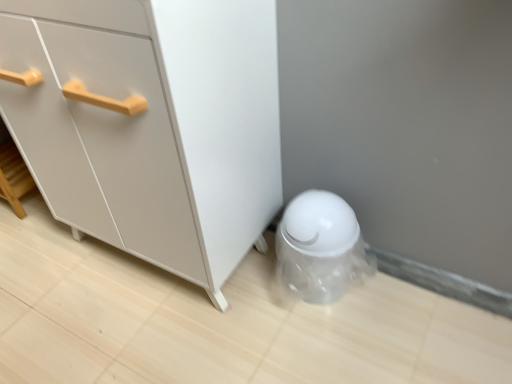
Question: From the image's perspective, is transparent plastic trash can at lower right located above or below white matte cabinet at center?

Choices:
 (A) above
 (B) below

Answer: (B)

Question: Would you say transparent plastic trash can at lower right is to the left or to the right of white matte cabinet at center in the picture?

Choices:
 (A) right
 (B) left

Answer: (A)

Question: Is point (329, 249) closer or farther from the camera than point (80, 225)?

Choices:
 (A) farther
 (B) closer

Answer: (B)

Question: In the image, is white matte cabinet at center positioned in front of or behind transparent plastic trash can at lower right?

Choices:
 (A) behind
 (B) front

Answer: (B)

Question: In terms of size, does white matte cabinet at center appear bigger or smaller than transparent plastic trash can at lower right?

Choices:
 (A) big
 (B) small

Answer: (A)

Question: Would you say white matte cabinet at center is inside or outside transparent plastic trash can at lower right?

Choices:
 (A) outside
 (B) inside

Answer: (A)

Question: Is white matte cabinet at center to the left or to the right of transparent plastic trash can at lower right in the image?

Choices:
 (A) right
 (B) left

Answer: (B)